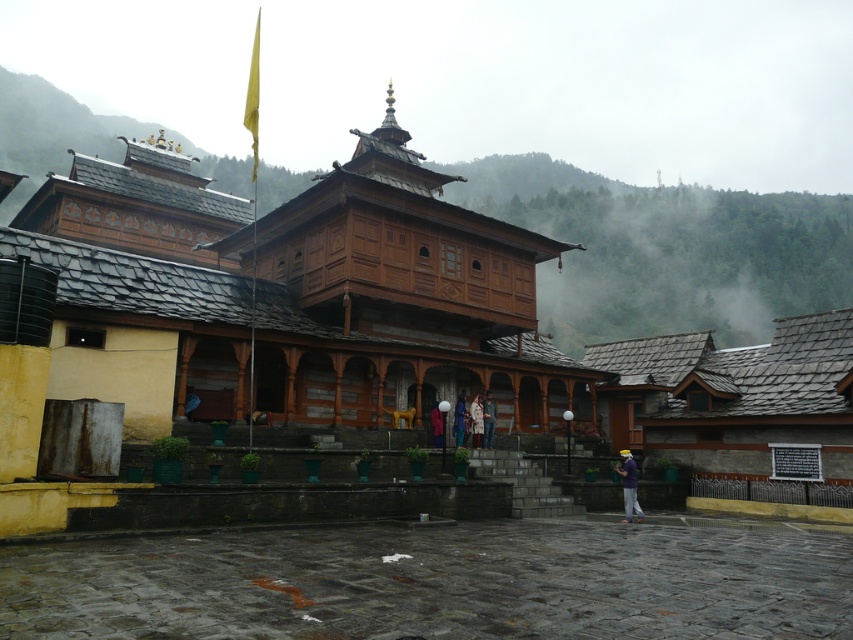
You are standing at point (291, 294) in the temple complex. What is the name of the structure located exactly at this point?

The wooden temple at center is located at point (291, 294).

You are standing in the temple complex and notice the wooden temple at center and the blue fabric person at center. Which object is positioned to the left from your perspective?

The wooden temple at center is to the left of the blue fabric person at center.

You are a visitor at the temple complex and notice a white fabric coat at center and a blue fabric person at center. Which object is taller?

The white fabric coat at center is taller than the blue fabric person at center.